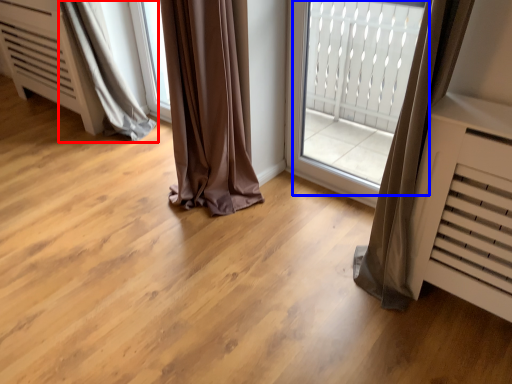
Question: Among these objects, which one is nearest to the camera, curtain (highlighted by a red box) or bay window (highlighted by a blue box)?

Choices:
 (A) curtain
 (B) bay window

Answer: (B)